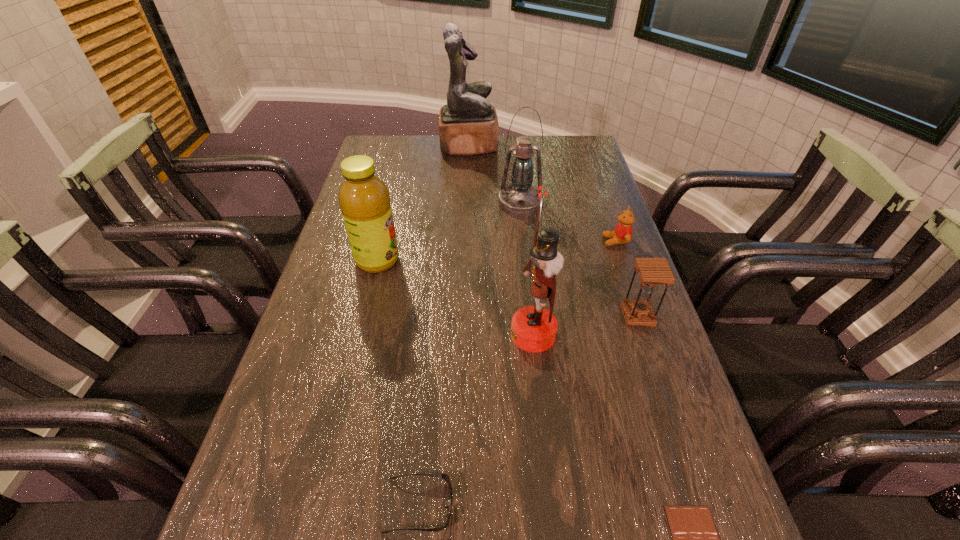
Locate an element on the screen. vacant region located 0.190m on the front-facing side of the nutcracker is located at coordinates (427, 334).

You are a GUI agent. You are given a task and a screenshot of the screen. Output one action in this format:
    pyautogui.click(x=<x>, y=<y>)
    Task: Click on the vacant space situated on the left of the oil lamp
    This screenshot has height=540, width=960.
    Given the screenshot: What is the action you would take?
    pyautogui.click(x=393, y=203)

At what (x,y) coordinates should I click in order to perform the action: click on vacant point located 0.250m on the front label of the leftmost object. Please return your answer as a coordinate pair (x, y). Looking at the image, I should click on (492, 260).

The image size is (960, 540). In order to click on vacant region located 0.380m on the back of the fifth tallest object in this screenshot , I will do `click(603, 213)`.

Image resolution: width=960 pixels, height=540 pixels. In order to click on vacant region located on the front-facing side of the sixth tallest object in this screenshot , I will do `click(550, 241)`.

Identify the location of vacant space located on the front-facing side of the sixth tallest object. (557, 241).

Identify the location of blank space located on the front-facing side of the sixth tallest object. The width and height of the screenshot is (960, 540). (490, 241).

Identify the location of free space located on the front-facing side of the second shortest object. tap(488, 505).

The width and height of the screenshot is (960, 540). Identify the location of object present at the far edge. (468, 125).

Find the location of a particular element. object at the left edge is located at coordinates (364, 199).